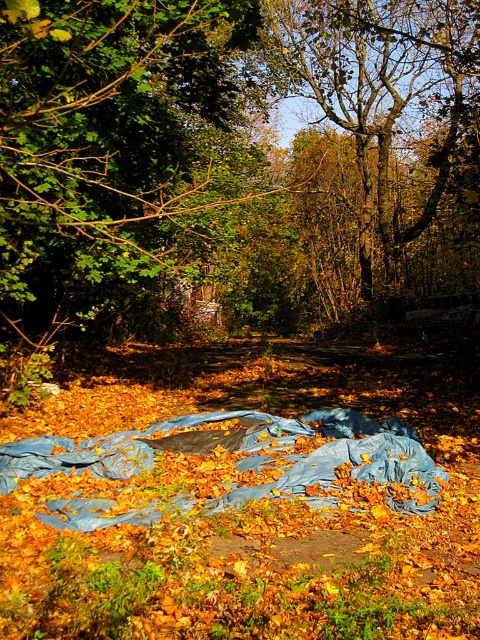
Question: Among these objects, which one is farthest from the camera?

Choices:
 (A) brown textured tree at upper center
 (B) green leafy tree at upper left

Answer: (A)

Question: Is green leafy tree at upper left bigger than brown textured tree at upper center?

Choices:
 (A) yes
 (B) no

Answer: (B)

Question: Among these points, which one is nearest to the camera?

Choices:
 (A) (408, 122)
 (B) (12, 115)

Answer: (B)

Question: Which object is closer to the camera taking this photo?

Choices:
 (A) green leafy tree at upper left
 (B) brown textured tree at upper center

Answer: (A)

Question: Observing the image, what is the correct spatial positioning of green leafy tree at upper left in reference to brown textured tree at upper center?

Choices:
 (A) below
 (B) above

Answer: (A)

Question: Does green leafy tree at upper left come in front of brown textured tree at upper center?

Choices:
 (A) yes
 (B) no

Answer: (A)